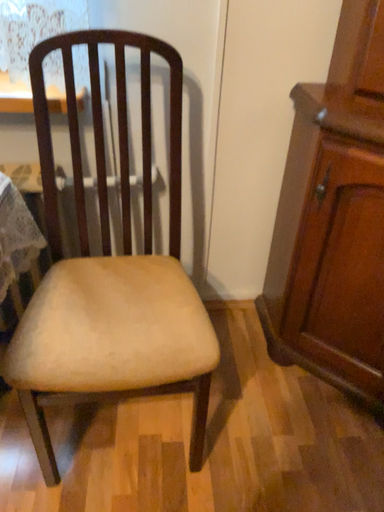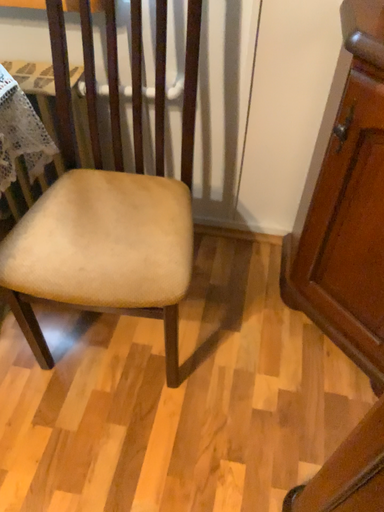
Question: How did the camera likely rotate when shooting the video?

Choices:
 (A) rotated upward
 (B) rotated downward

Answer: (B)